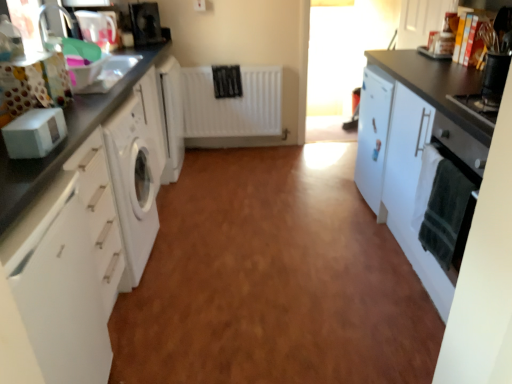
Question: Looking at their shapes, would you say white glossy jug at upper left, which is the third appliance from bottom to top, is wider or thinner than white matte cabinet at right, marked as the third cabinetry in a left-to-right arrangement?

Choices:
 (A) thin
 (B) wide

Answer: (A)

Question: Based on their positions, is white glossy jug at upper left, which is the 4th appliance in right-to-left order, located to the left or right of white matte cabinet at right, which ranks as the first cabinetry in right-to-left order?

Choices:
 (A) right
 (B) left

Answer: (B)

Question: Which object is the closest to the white glossy washing machine at left?

Choices:
 (A) white glossy cabinet at left, the third cabinetry positioned from the right
 (B) white matte radiator at center
 (C) white matte cabinet at left, the 2th cabinetry from the right
 (D) green towel at right
 (E) white glossy jug at upper left, which is the third appliance from bottom to top

Answer: (C)

Question: Which is farther from the green towel at right?

Choices:
 (A) black glossy fan at upper center, which ranks as the fourth appliance in bottom-to-top order
 (B) white glossy cabinet at left, the third cabinetry positioned from the right
 (C) white matte cabinet at left, arranged as the second cabinetry when viewed from the left
 (D) white glossy washing machine at left
 (E) white matte cabinet at right, which ranks as the first cabinetry in right-to-left order

Answer: (A)